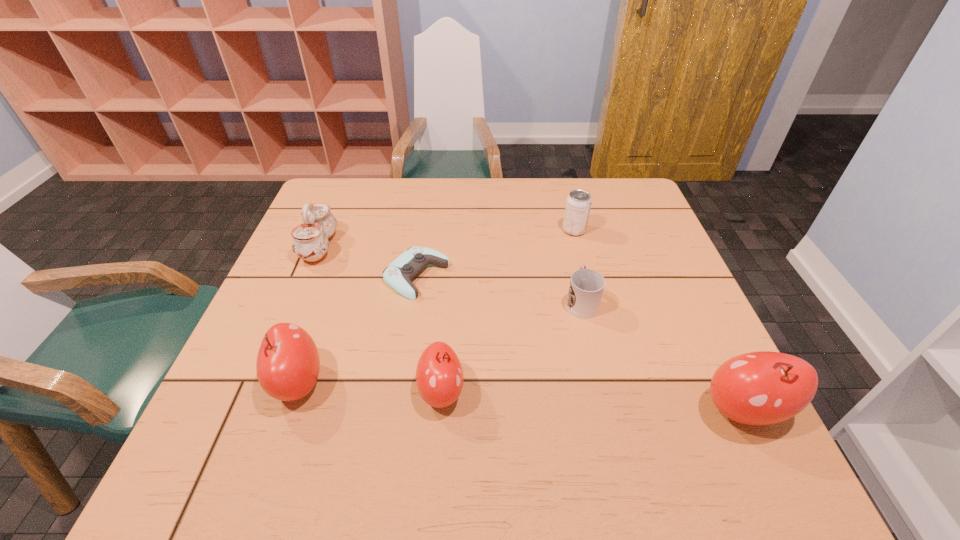
Identify the location of the second shortest apple. (288, 363).

This screenshot has height=540, width=960. In order to click on the second apple from left to right in this screenshot , I will do `click(439, 375)`.

At what (x,y) coordinates should I click in order to perform the action: click on the rightmost apple. Please return your answer as a coordinate pair (x, y). This screenshot has width=960, height=540. Looking at the image, I should click on (760, 388).

Identify the location of soda can. The height and width of the screenshot is (540, 960). (578, 204).

Image resolution: width=960 pixels, height=540 pixels. What are the coordinates of `the shortest object` in the screenshot? It's located at coord(408,265).

Where is `chinaware`? The height and width of the screenshot is (540, 960). chinaware is located at coordinates (310, 242).

Where is `the second shortest object`? the second shortest object is located at coordinates (586, 287).

Find the location of a particular element. vacant space located 0.400m on the back of the leftmost apple is located at coordinates (348, 239).

Image resolution: width=960 pixels, height=540 pixels. I want to click on free space located on the left of the shortest apple, so click(x=323, y=392).

Where is `free space located 0.300m on the left of the rightmost object`? This screenshot has width=960, height=540. free space located 0.300m on the left of the rightmost object is located at coordinates click(x=542, y=410).